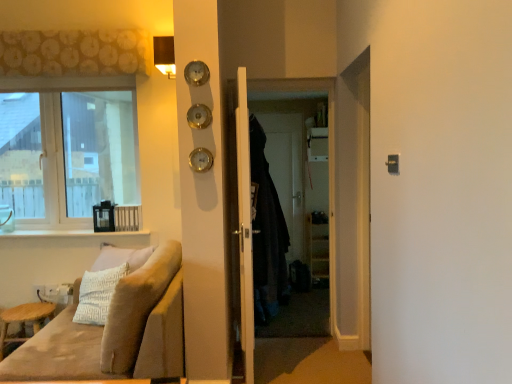
Question: From a real-world perspective, is velvet beige couch at lower left physically located above or below clear glass window at upper left?

Choices:
 (A) below
 (B) above

Answer: (A)

Question: Does point (180, 339) appear closer or farther from the camera than point (33, 102)?

Choices:
 (A) farther
 (B) closer

Answer: (B)

Question: Which object is positioned closest to the patterned fabric curtain at upper left?

Choices:
 (A) dark fabric screen door at center
 (B) clear glass window at upper left
 (C) white wooden door at center
 (D) gold metallic clock at center
 (E) dark fabric coat at center

Answer: (B)

Question: Which is nearer to the light brown wooden stool at lower left?

Choices:
 (A) dark fabric screen door at center
 (B) white wooden door at center
 (C) velvet beige couch at lower left
 (D) white glossy window sill at lower left
 (E) dark fabric coat at center

Answer: (D)